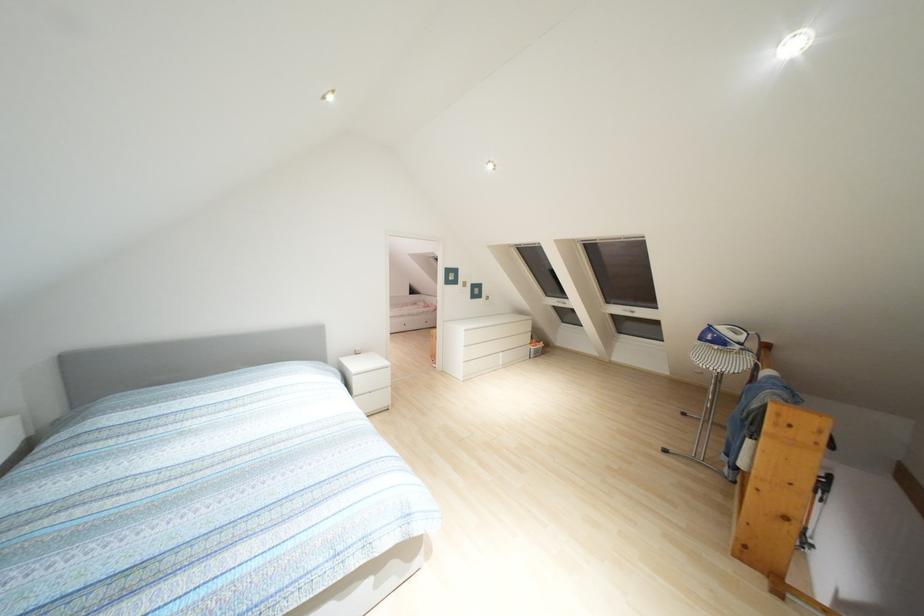
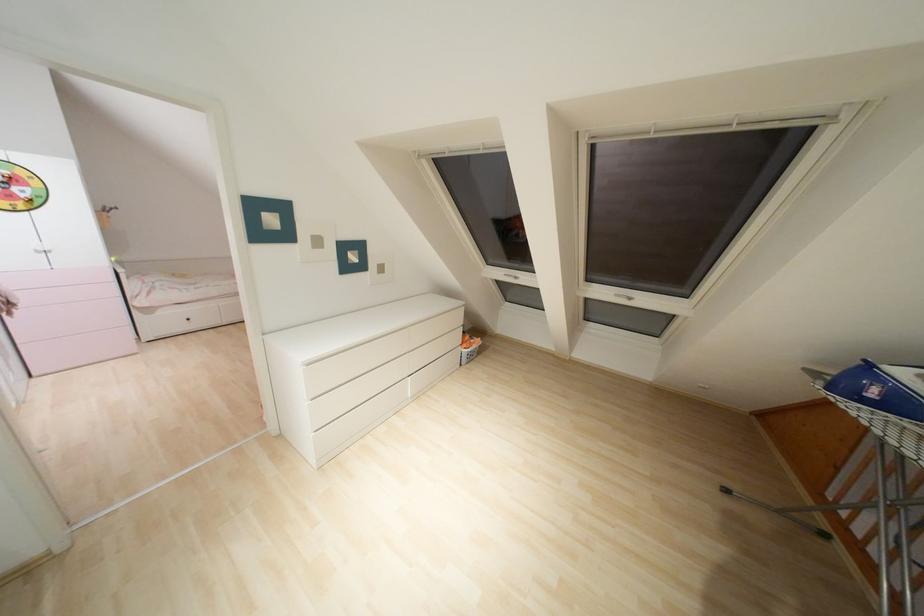
Question: Which direction would the cameraman need to move to produce the second image? Reply with the corresponding letter.

Choices:
 (A) Left
 (B) Right
 (C) Forward
 (D) Backward

Answer: (C)